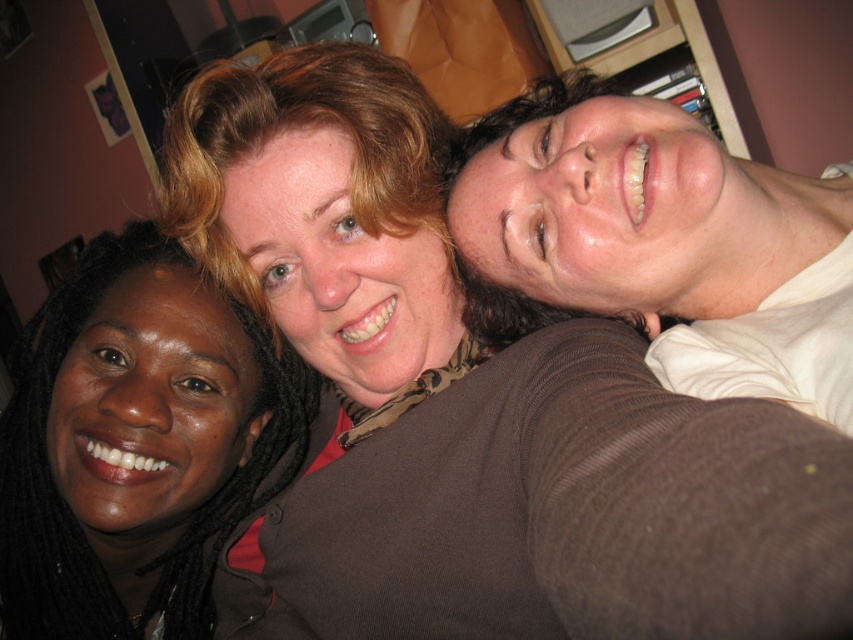
Looking at this image, you are taking a photo of three people in a living room. The camera is positioned at a certain distance. There is a point labeled as point (300, 442) in the scene. If the camera is 33.58 inches away from this point, will the three people be in focus if the camera has a depth of field that can focus on objects within 30 inches to 40 inches from the lens?

The point (300, 442) is 33.58 inches from the camera. Since the depth of field ranges from 30 to 40 inches, the three people will be in focus as they are within this range.